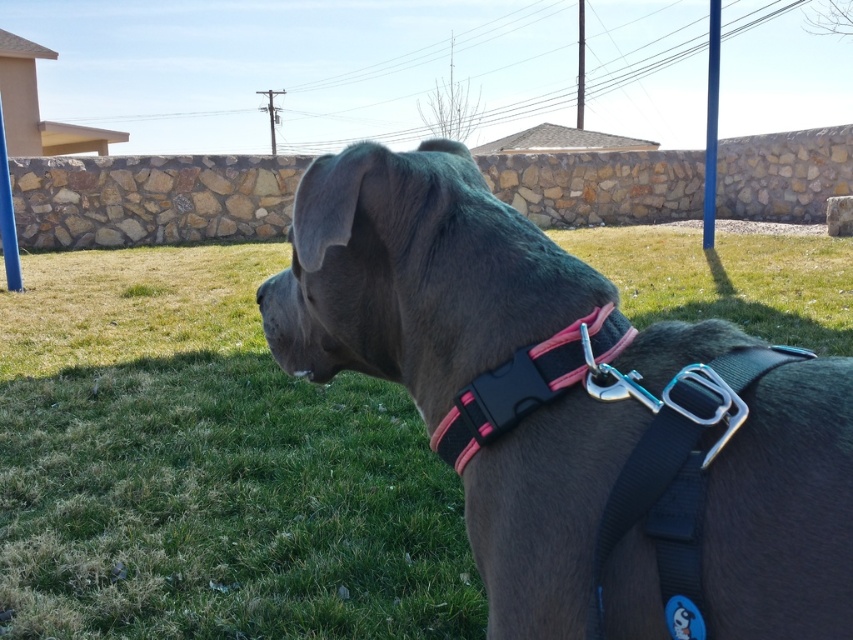
Between matte gray dog at center and pink matte plastic collar at center, which one is positioned higher?

matte gray dog at center is above.

Does matte gray dog at center lie in front of pink matte plastic collar at center?

Yes.

Does point (631, 480) come behind point (509, 416)?

No.

The width and height of the screenshot is (853, 640). In order to click on matte gray dog at center in this screenshot , I will do `click(575, 412)`.